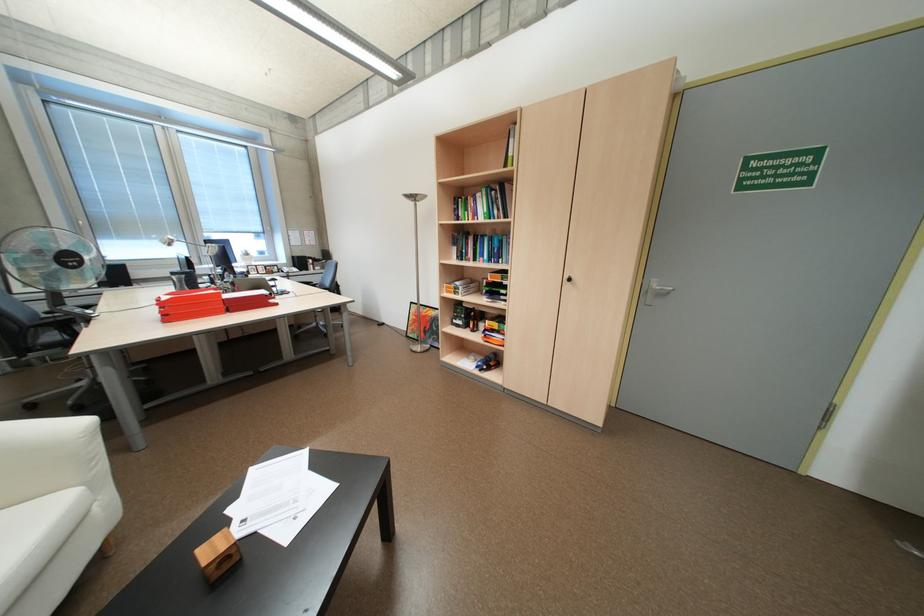
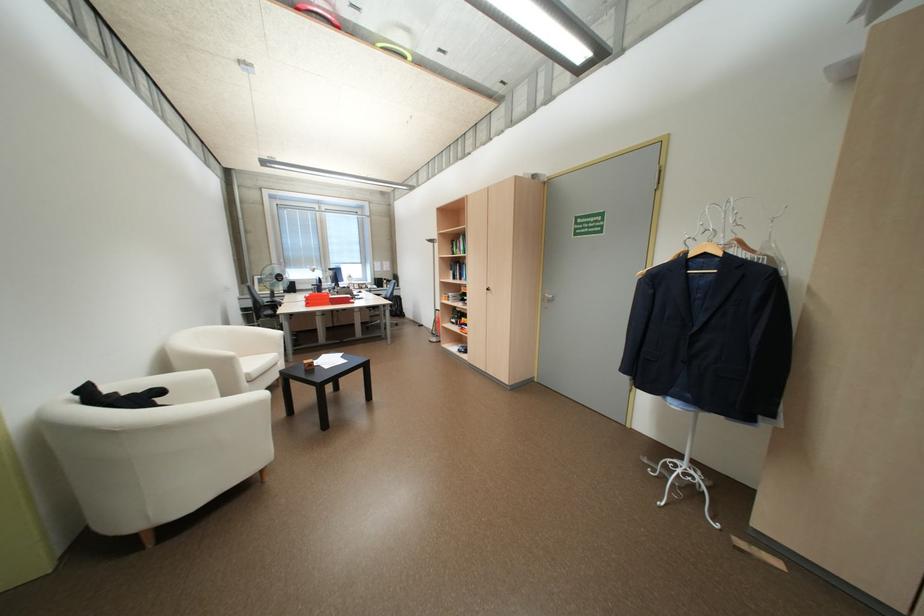
In the second image, find the point that corresponds to point 237,294 in the first image.

(342, 296)